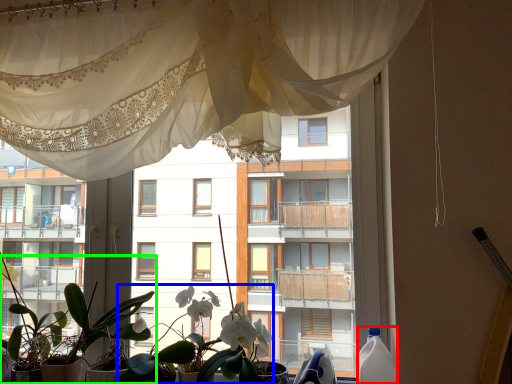
Question: Based on their relative distances, which object is nearer to bottle (highlighted by a red box)? Choose from floral arrangement (highlighted by a blue box) and houseplant (highlighted by a green box).

Choices:
 (A) floral arrangement
 (B) houseplant

Answer: (A)